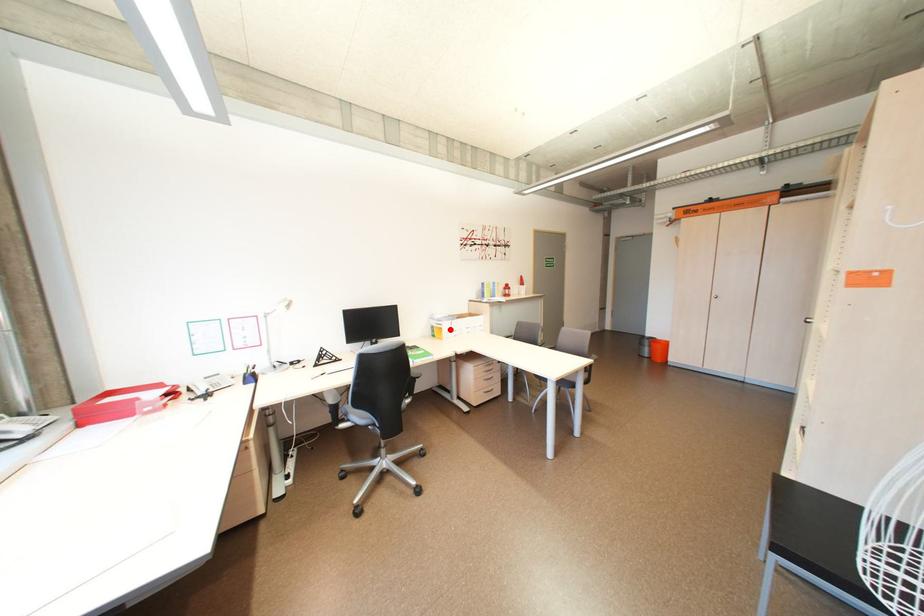
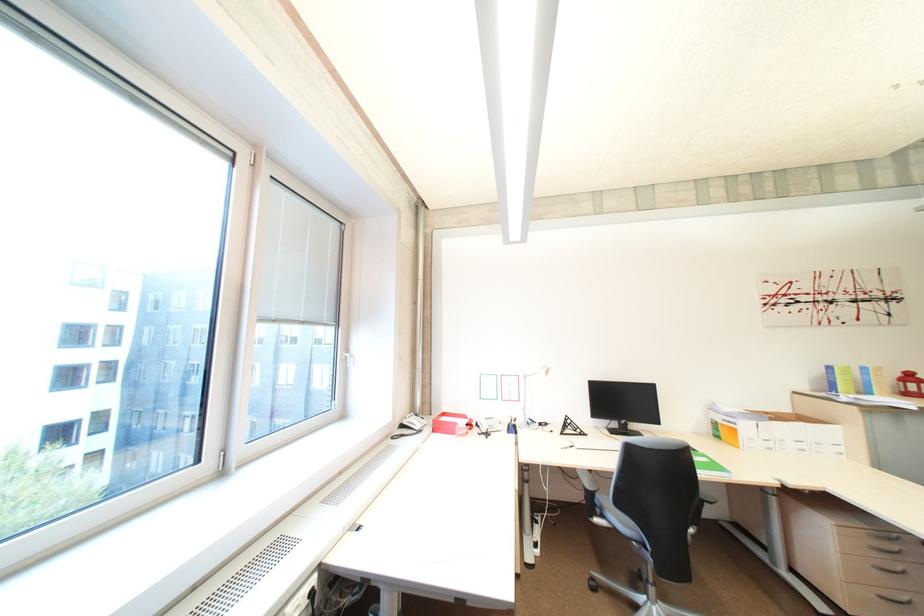
Where in the second image is the point corresponding to the highlighted location from the first image?

(745, 431)